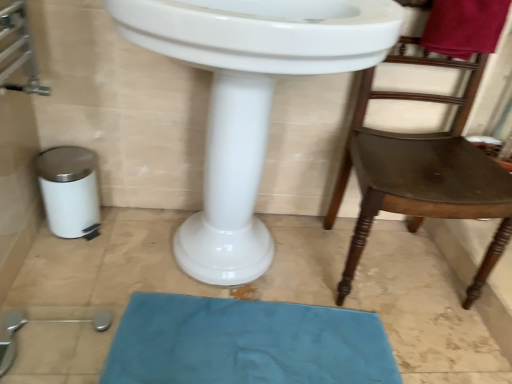
Question: From the image's perspective, is blue fabric bath mat at lower center on top of white glossy sink at center?

Choices:
 (A) yes
 (B) no

Answer: (B)

Question: Is blue fabric bath mat at lower center at the left side of white glossy sink at center?

Choices:
 (A) no
 (B) yes

Answer: (A)

Question: Is blue fabric bath mat at lower center surrounding white glossy sink at center?

Choices:
 (A) yes
 (B) no

Answer: (B)

Question: Is blue fabric bath mat at lower center outside of white glossy sink at center?

Choices:
 (A) yes
 (B) no

Answer: (A)

Question: Does blue fabric bath mat at lower center have a larger size compared to white glossy sink at center?

Choices:
 (A) yes
 (B) no

Answer: (B)

Question: From a real-world perspective, is blue fabric bath mat at lower center beneath white glossy sink at center?

Choices:
 (A) no
 (B) yes

Answer: (B)

Question: From the image's perspective, would you say blue fabric bath mat at lower center is shown under brown wooden chair at right?

Choices:
 (A) yes
 (B) no

Answer: (A)

Question: Is blue fabric bath mat at lower center to the left of brown wooden chair at right from the viewer's perspective?

Choices:
 (A) no
 (B) yes

Answer: (B)

Question: From a real-world perspective, does blue fabric bath mat at lower center stand above brown wooden chair at right?

Choices:
 (A) yes
 (B) no

Answer: (B)

Question: Is blue fabric bath mat at lower center turned away from brown wooden chair at right?

Choices:
 (A) no
 (B) yes

Answer: (A)

Question: Is blue fabric bath mat at lower center behind brown wooden chair at right?

Choices:
 (A) yes
 (B) no

Answer: (A)

Question: Can you confirm if blue fabric bath mat at lower center is bigger than brown wooden chair at right?

Choices:
 (A) no
 (B) yes

Answer: (A)

Question: Does brown wooden chair at right have a larger size compared to white glossy sink at center?

Choices:
 (A) no
 (B) yes

Answer: (A)